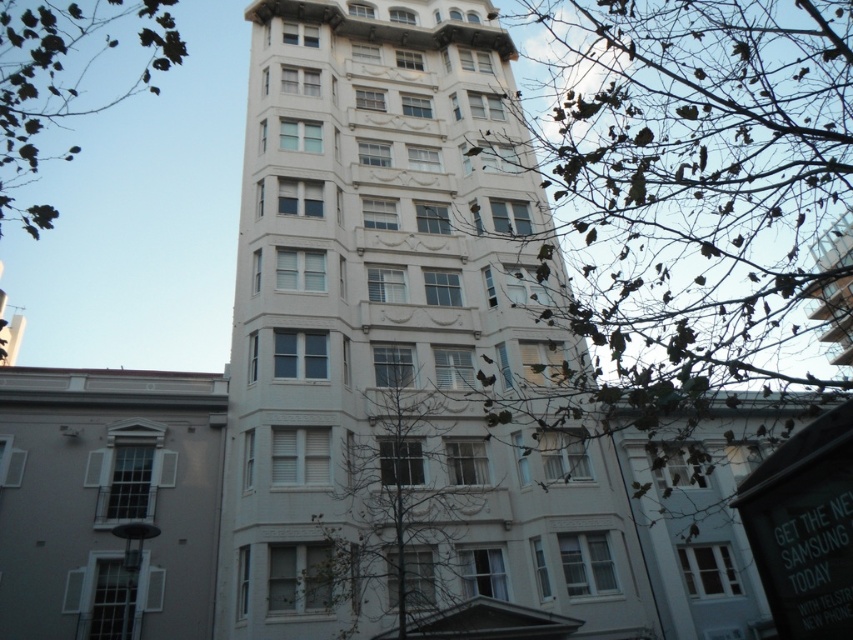
Does green leafy tree at upper right have a greater height compared to green leafy tree at upper left?

Yes.

Does green leafy tree at upper right appear on the left side of green leafy tree at upper left?

No, green leafy tree at upper right is not to the left of green leafy tree at upper left.

Which is behind, point (816, 240) or point (141, 24)?

Positioned behind is point (141, 24).

Image resolution: width=853 pixels, height=640 pixels. What are the coordinates of `green leafy tree at upper right` in the screenshot? It's located at (697, 189).

Who is positioned more to the left, white smooth building at center or green leafless tree at center?

Positioned to the left is white smooth building at center.

Consider the image. Between white smooth building at center and green leafless tree at center, which one appears on the right side from the viewer's perspective?

green leafless tree at center

Is point (430, 579) behind point (413, 522)?

That is False.

Identify the location of white smooth building at center. (383, 330).

Does white smooth building at center have a larger size compared to green leafy tree at upper left?

No, white smooth building at center is not bigger than green leafy tree at upper left.

Does white smooth building at center have a lesser width compared to green leafy tree at upper left?

Indeed, white smooth building at center has a lesser width compared to green leafy tree at upper left.

Locate an element on the screen. white smooth building at center is located at coordinates (383, 330).

The image size is (853, 640). Identify the location of white smooth building at center. (383, 330).